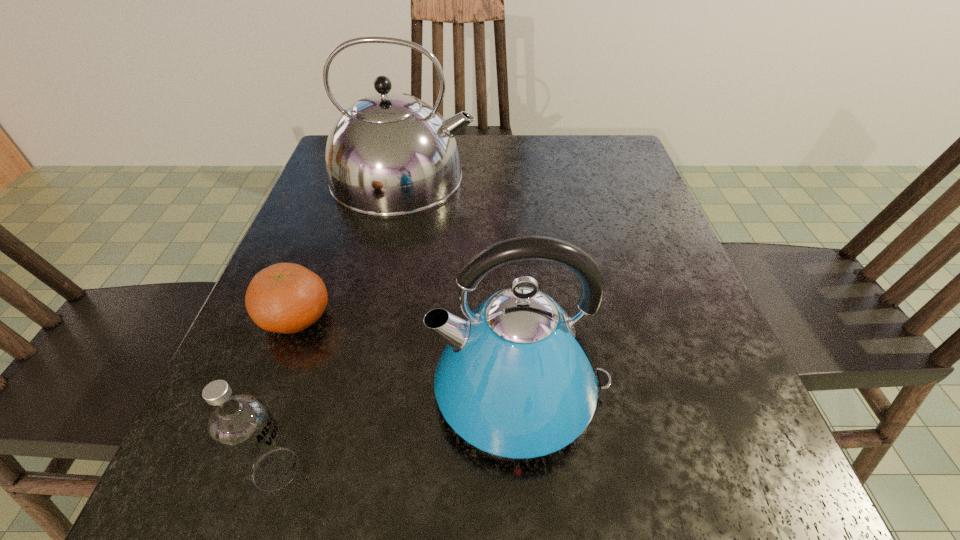
In the image, there is a desktop. What are the coordinates of `free region at the far right corner` in the screenshot? It's located at (625, 171).

Identify the location of free spot at the near right corner of the desktop. Image resolution: width=960 pixels, height=540 pixels. (756, 511).

At what (x,y) coordinates should I click in order to perform the action: click on vacant space that is in between the shortest object and the nearer kettle. Please return your answer as a coordinate pair (x, y). The image size is (960, 540). Looking at the image, I should click on (408, 354).

The height and width of the screenshot is (540, 960). Identify the location of free spot between the shortest object and the third tallest object. (286, 394).

Image resolution: width=960 pixels, height=540 pixels. I want to click on free space between the vodka and the farthest object, so click(x=340, y=323).

What are the coordinates of `vacant point located between the farthest object and the second shortest object` in the screenshot? It's located at (340, 323).

Where is `free point between the third tallest object and the shortest object`? The image size is (960, 540). free point between the third tallest object and the shortest object is located at coordinates [x=286, y=394].

You are a GUI agent. You are given a task and a screenshot of the screen. Output one action in this format:
    pyautogui.click(x=<x>, y=<y>)
    Task: Click on the empty location between the shortest object and the vodka
    This screenshot has width=960, height=540.
    Given the screenshot: What is the action you would take?
    pyautogui.click(x=286, y=394)

You are a GUI agent. You are given a task and a screenshot of the screen. Output one action in this format:
    pyautogui.click(x=<x>, y=<y>)
    Task: Click on the empty space between the nearer kettle and the second shortest object
    
    Given the screenshot: What is the action you would take?
    pyautogui.click(x=398, y=430)

Identify the location of vacant space that is in between the third tallest object and the shortest object. (286, 394).